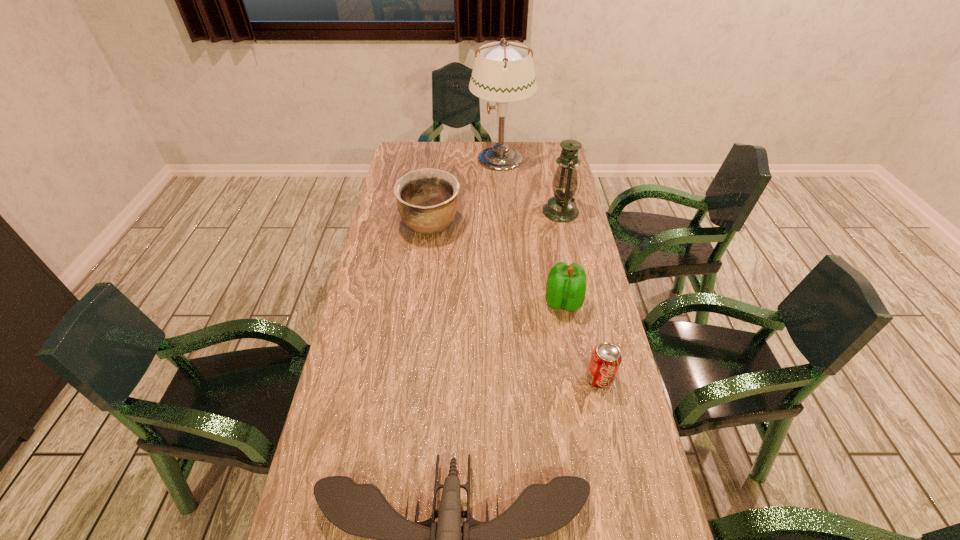
Find the location of `object that stands as the fifth closest to the second tallest object`. object that stands as the fifth closest to the second tallest object is located at coordinates tap(361, 510).

Locate an element on the screen. vacant point that satisfies the following two spatial constraints: 1. on the lampshade of the lampshade; 2. on the right side of the bell pepper is located at coordinates (510, 302).

The width and height of the screenshot is (960, 540). Find the location of `vacant area that satisfies the following two spatial constraints: 1. on the lampshade of the oil lamp; 2. on the left side of the farthest object`. vacant area that satisfies the following two spatial constraints: 1. on the lampshade of the oil lamp; 2. on the left side of the farthest object is located at coordinates (504, 212).

Find the location of a particular element. The height and width of the screenshot is (540, 960). free point that satisfies the following two spatial constraints: 1. on the front side of the pottery; 2. on the left side of the soda can is located at coordinates (411, 378).

This screenshot has width=960, height=540. I want to click on free point that satisfies the following two spatial constraints: 1. on the front side of the second nearest object; 2. on the left side of the pottery, so click(411, 378).